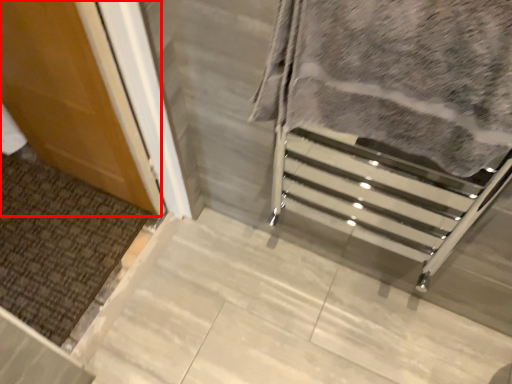
Question: From the image's perspective, what is the correct spatial relationship of door (annotated by the red box) in relation to blanket?

Choices:
 (A) above
 (B) below

Answer: (A)